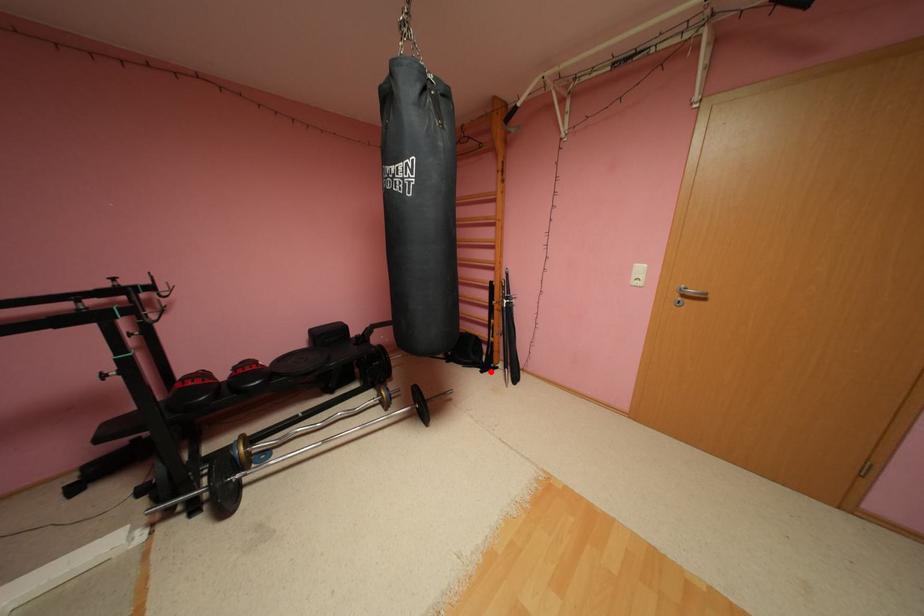
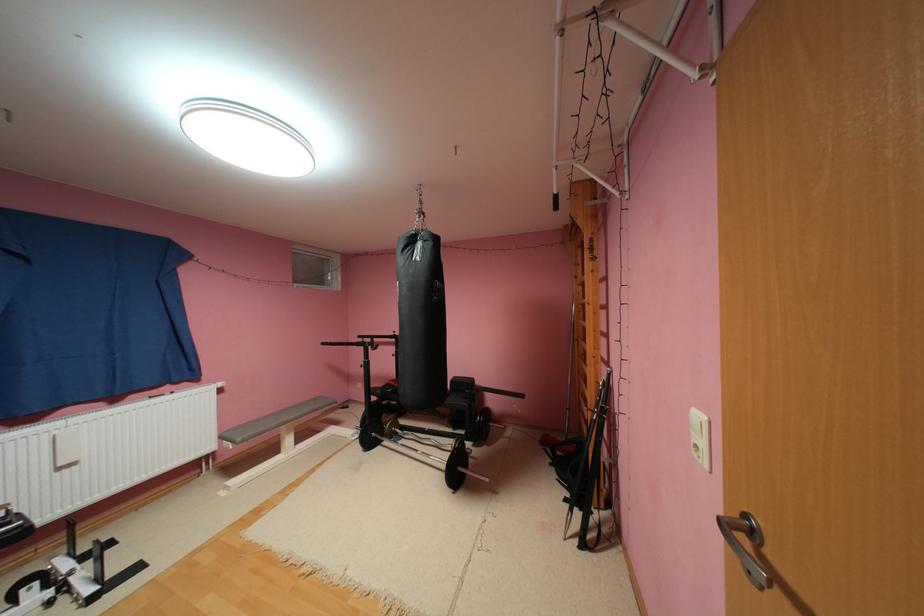
Question: I am providing you with two images of the same scene from different viewpoints. A red point is marked on the first image. Is the red point's position out of view in image 2?

Choices:
 (A) Yes
 (B) No

Answer: (B)